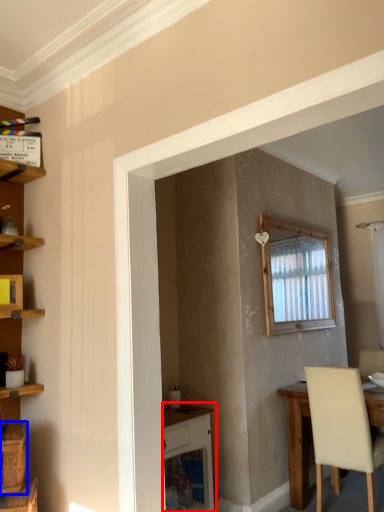
Question: Among these objects, which one is nearest to the camera, vanity (highlighted by a red box) or basket (highlighted by a blue box)?

Choices:
 (A) vanity
 (B) basket

Answer: (B)